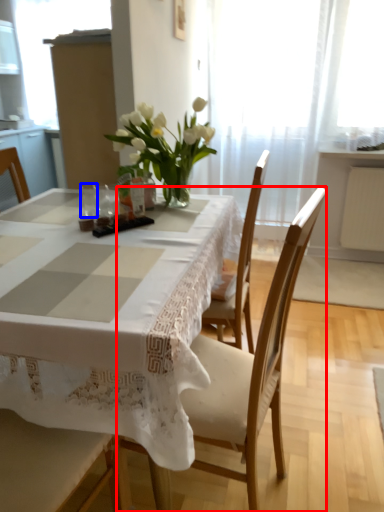
Question: Among these objects, which one is nearest to the camera, chair (highlighted by a red box) or tableware (highlighted by a blue box)?

Choices:
 (A) chair
 (B) tableware

Answer: (A)